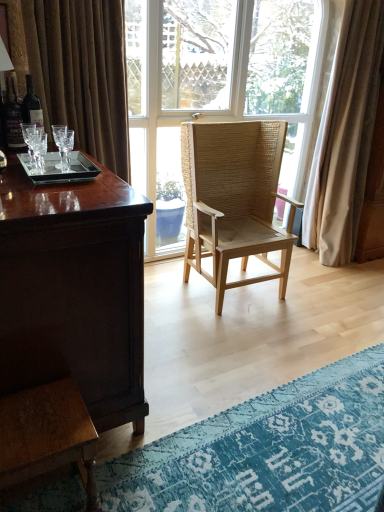
Identify the location of spots to the right of shiny brown wood desk at left. (201, 360).